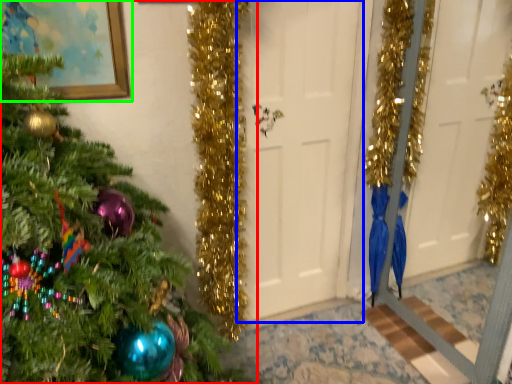
Question: Which object is the farthest from christmas tree (highlighted by a red box)? Choose among these: door (highlighted by a blue box) or picture frame (highlighted by a green box).

Choices:
 (A) door
 (B) picture frame

Answer: (A)